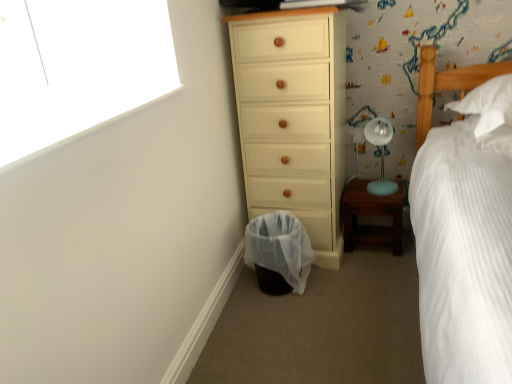
Locate an element on the screen. The image size is (512, 384). free space in front of translucent plastic laundry basket at lower center is located at coordinates (291, 317).